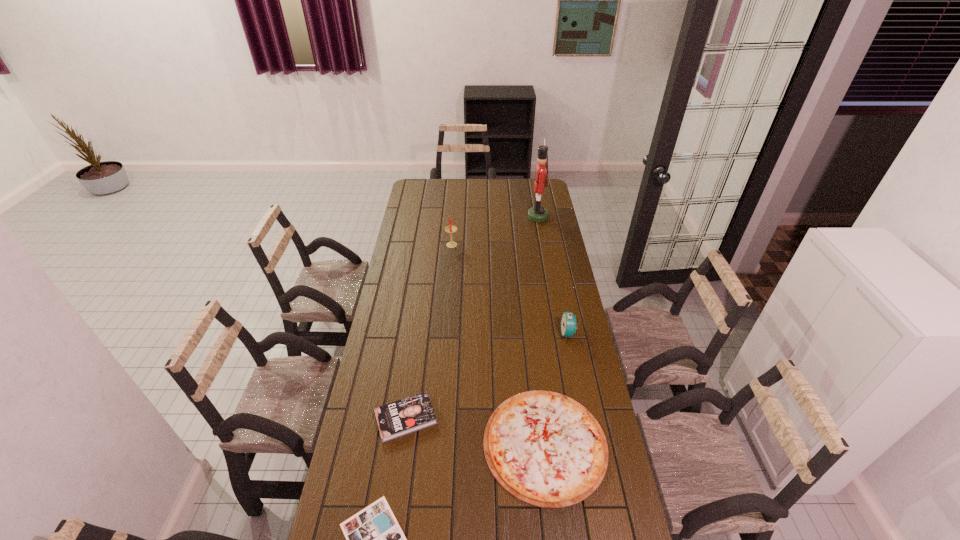
At what (x,y) coordinates should I click in order to perform the action: click on alarm clock present at the right edge. Please return your answer as a coordinate pair (x, y). Looking at the image, I should click on (568, 320).

You are a GUI agent. You are given a task and a screenshot of the screen. Output one action in this format:
    pyautogui.click(x=<x>, y=<y>)
    Task: Click on the pizza at the right edge
    The width and height of the screenshot is (960, 540).
    Given the screenshot: What is the action you would take?
    pyautogui.click(x=544, y=448)

In the image, there is a desktop. Identify the location of vacant region at the far edge. (479, 191).

Locate an element on the screen. This screenshot has height=540, width=960. vacant area at the left edge of the desktop is located at coordinates (410, 303).

Find the location of a particular element. vacant region at the right edge of the desktop is located at coordinates coord(576,354).

The image size is (960, 540). Identify the location of vacant area at the far left corner. (411, 198).

At what (x,y) coordinates should I click in order to perform the action: click on vacant space that's between the taller book and the nutcracker. Please return your answer as a coordinate pair (x, y). The height and width of the screenshot is (540, 960). Looking at the image, I should click on (471, 318).

Locate an element on the screen. The height and width of the screenshot is (540, 960). free space between the fifth nearest object and the fifth tallest object is located at coordinates (498, 344).

This screenshot has height=540, width=960. In order to click on unoccupied area between the pizza and the second farthest object in this screenshot , I will do `click(498, 344)`.

This screenshot has height=540, width=960. What are the coordinates of `empty location between the candle and the fourth nearest object` in the screenshot? It's located at (510, 288).